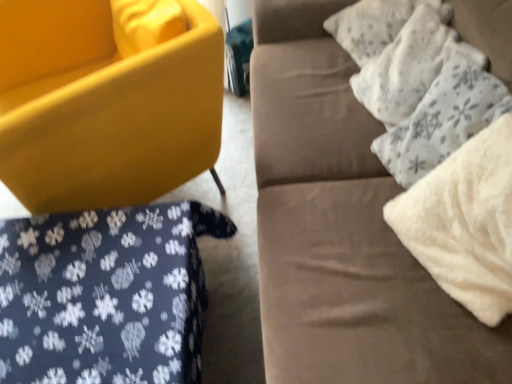
Question: From a real-world perspective, relative to white textured pillow at upper right, the second pillow when ordered from bottom to top, is dark blue fabric with white snowflake pattern at lower left vertically above or below?

Choices:
 (A) below
 (B) above

Answer: (A)

Question: Does point (200, 258) appear closer or farther from the camera than point (401, 114)?

Choices:
 (A) farther
 (B) closer

Answer: (A)

Question: Which object is positioned farthest from the dark blue fabric with white snowflake pattern at lower left?

Choices:
 (A) white fluffy pillow at upper right, which is the 2th pillow from top to bottom
 (B) white textured pillow at upper right, the second pillow when ordered from bottom to top
 (C) matte yellow chair at lower left
 (D) suede couch at upper right
 (E) white fluffy pillow at right

Answer: (B)

Question: Estimate the real-world distances between objects in this image. Which object is farther from the white textured pillow at upper right, marked as the first pillow in a top-to-bottom arrangement?

Choices:
 (A) suede couch at upper right
 (B) white fluffy pillow at right
 (C) matte yellow chair at lower left
 (D) white fluffy pillow at upper right, which is the 2th pillow from top to bottom
 (E) dark blue fabric with white snowflake pattern at lower left

Answer: (E)